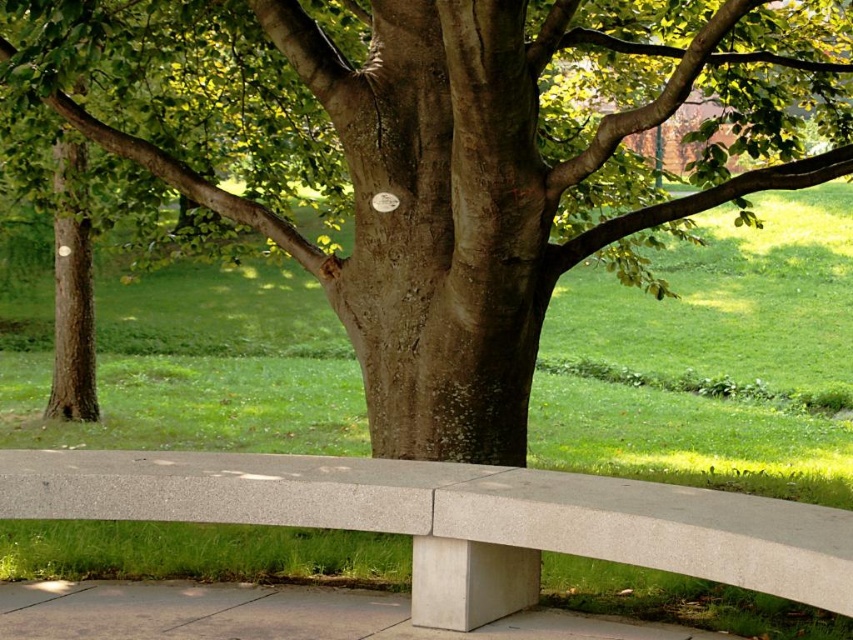
You are a person who wants to sit on the tallest bench in the scene. Which bench should you choose between the smooth gray bench at center and the gray concrete bench at lower center?

The smooth gray bench at center is taller than the gray concrete bench at lower center, so you should choose the smooth gray bench at center.

You are a gardener who needs to water the smooth brown tree trunk at center and the gray concrete bench at lower center. Your watering hose is 5 meters long. If you start from the bench, can you reach the tree trunk with the hose without moving the hose reel?

The distance between the smooth brown tree trunk at center and the gray concrete bench at lower center is 4.80 meters. Since the hose is 5 meters long, which is longer than the distance, you can reach the tree trunk from the bench without moving the hose reel.

You are planning to place a decorative pot on the gray concrete bench at lower center. The pot requires a base that is at least as wide as the smooth brown tree trunk at center. Can the bench support the pot?

The smooth brown tree trunk at center might be wider than gray concrete bench at lower center, so the bench may not have a wide enough surface to support the pot if the tree trunk is indeed wider.